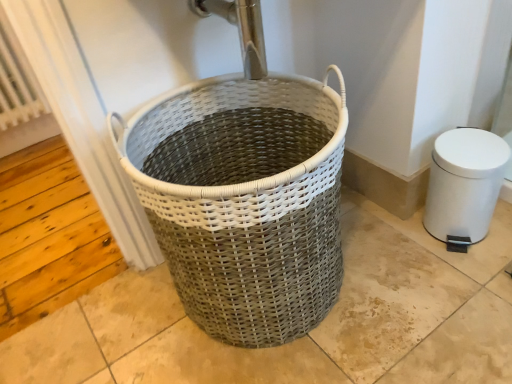
Where is `vacant space that is in between white woven basket at center and white plastic bidet at right`? vacant space that is in between white woven basket at center and white plastic bidet at right is located at coordinates (385, 259).